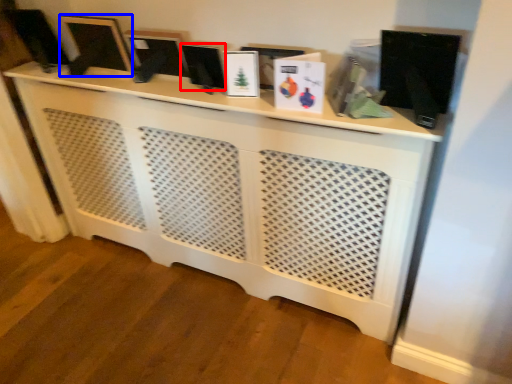
Question: Which object is further to the camera taking this photo, computer monitor (highlighted by a red box) or computer monitor (highlighted by a blue box)?

Choices:
 (A) computer monitor
 (B) computer monitor

Answer: (B)